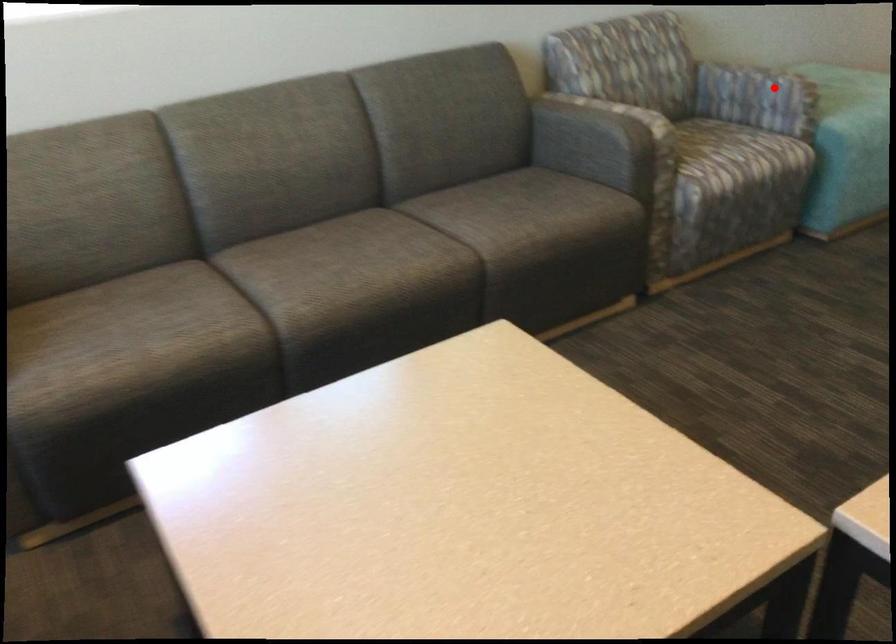
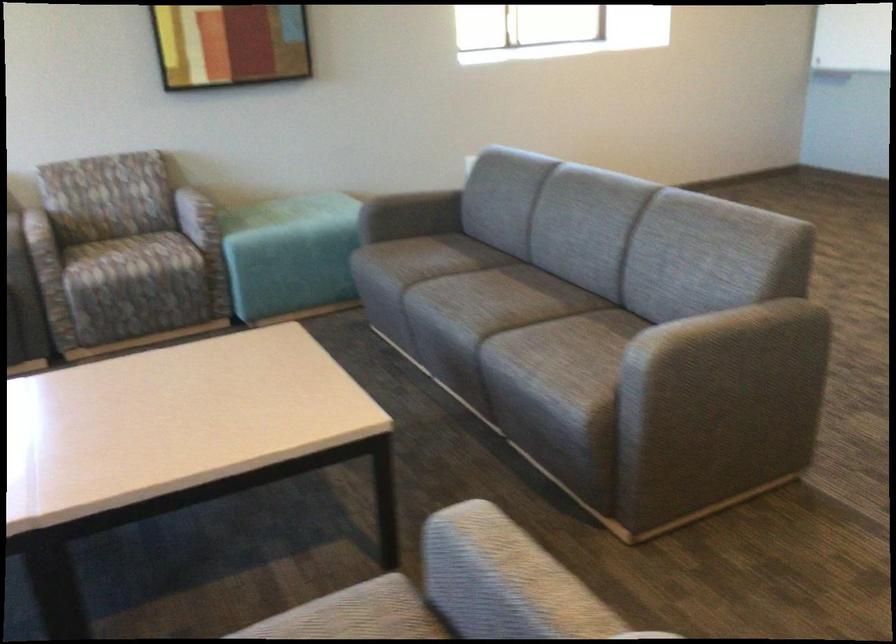
Question: I am providing you with two images of the same scene from different viewpoints. In image1, a red point is highlighted. Considering the same 3D point in image2, which of the following is correct?

Choices:
 (A) It is closer
 (B) It is farther

Answer: (B)